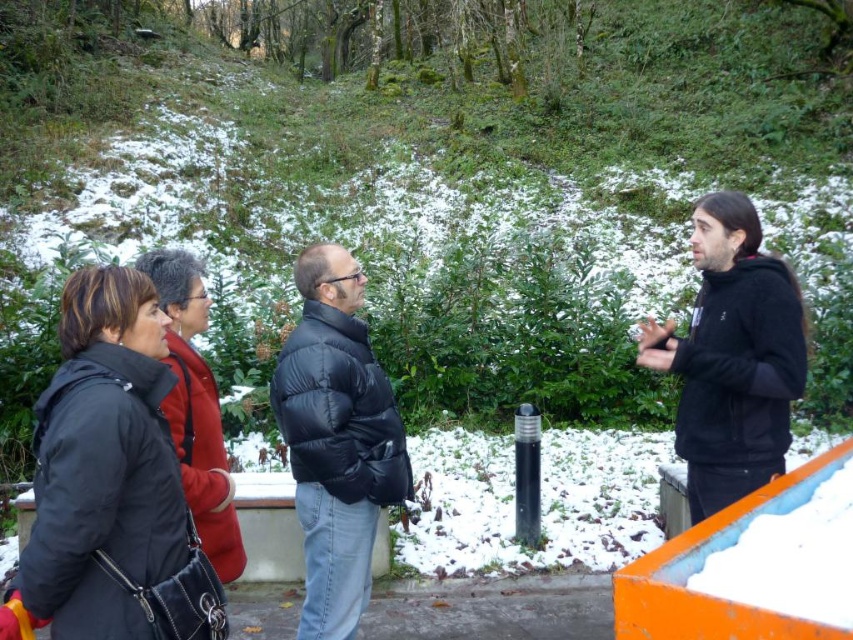
You are a photographer wanting to capture a group photo of the people in the scene. You need to ensure that both the black hoodie at right and the matte black jacket at left are fully visible in the photo. Based on their positions, is there any part of either clothing item that might be obscured from your current viewpoint?

The matte black jacket at left is behind the black hoodie at right, so part of the matte black jacket at left could be obscured by the black hoodie at right in the current viewpoint.

You are a photographer trying to capture a group photo of the black hoodie at right and the matte black jacket at left. The camera you are using has a maximum focus range of 6 feet. Can you take a photo of both subjects without moving either of them?

The distance between the black hoodie at right and matte black jacket at left is 6.01 feet, which exceeds the camera maximum focus range of 6 feet. Therefore, you cannot take a photo of both subjects without moving them closer together.